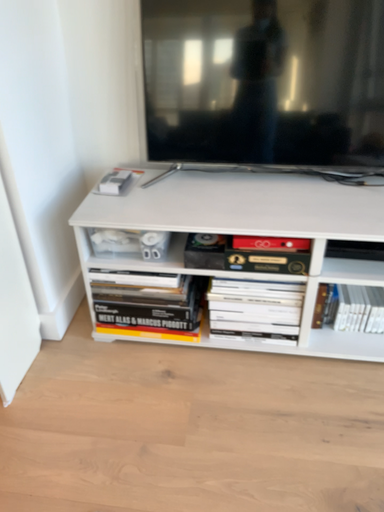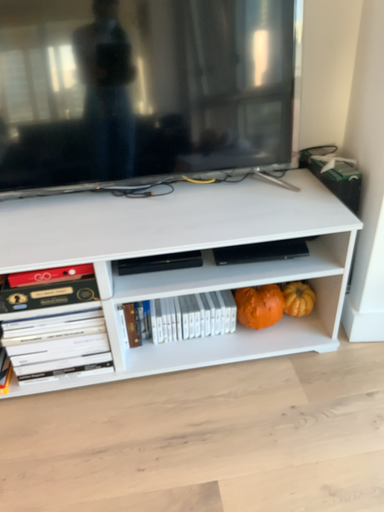
Question: Which way did the camera rotate in the video?

Choices:
 (A) rotated right
 (B) rotated left

Answer: (A)